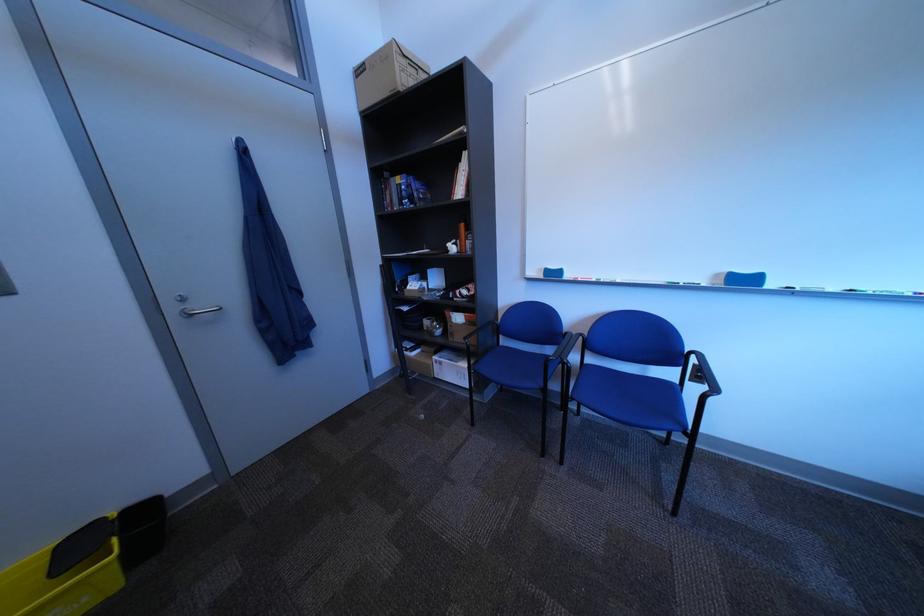
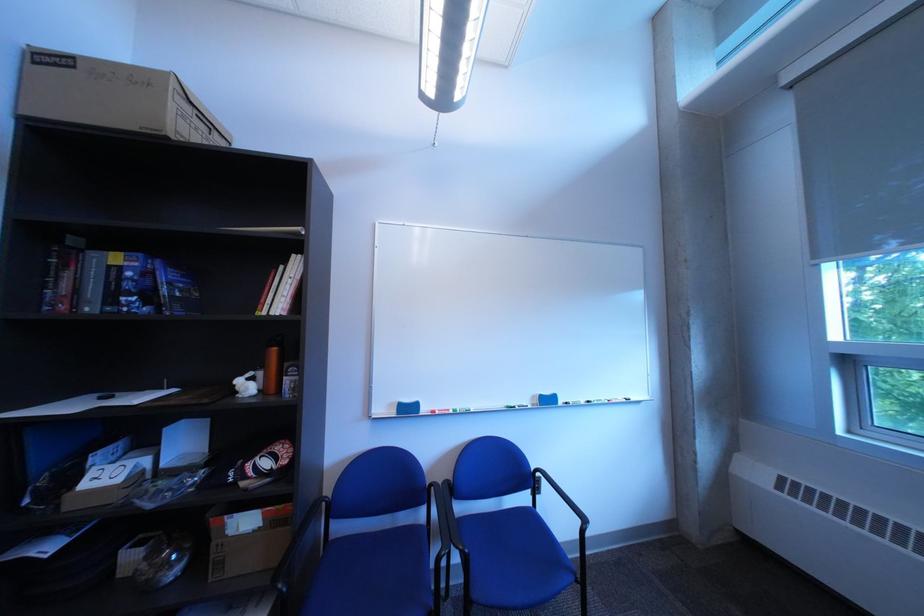
How did the camera likely rotate?

The camera rotated toward right-up.